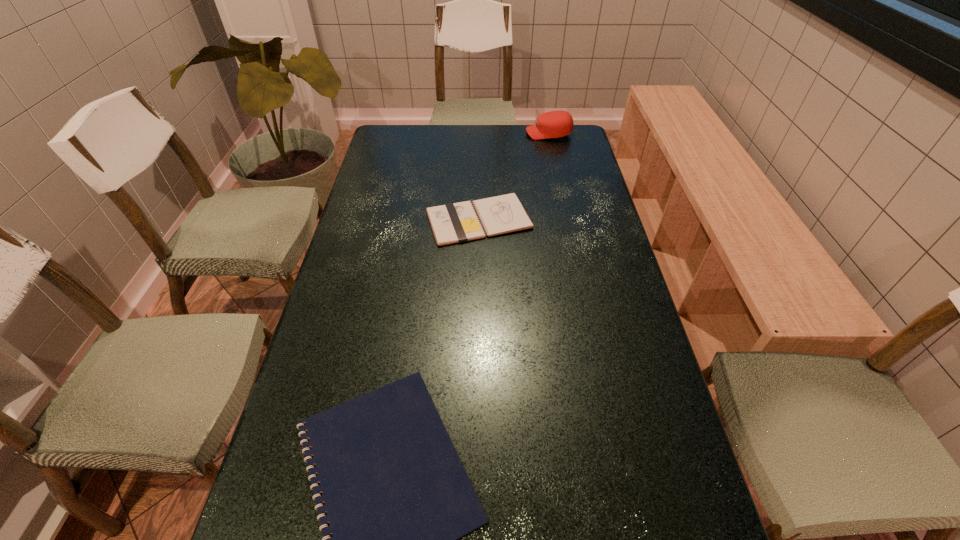
This screenshot has height=540, width=960. I want to click on object present at the far right corner, so click(553, 124).

You are a GUI agent. You are given a task and a screenshot of the screen. Output one action in this format:
    pyautogui.click(x=<x>, y=<y>)
    Task: Click on the blank space at the far edge
    
    Given the screenshot: What is the action you would take?
    pyautogui.click(x=489, y=135)

In the image, there is a desktop. Where is `vacant space at the left edge`? vacant space at the left edge is located at coordinates (387, 221).

This screenshot has height=540, width=960. In the image, there is a desktop. Find the location of `vacant space at the right edge`. vacant space at the right edge is located at coordinates (624, 434).

In the image, there is a desktop. Where is `vacant space at the far left corner`? This screenshot has height=540, width=960. vacant space at the far left corner is located at coordinates (408, 125).

Locate an element on the screen. Image resolution: width=960 pixels, height=540 pixels. vacant space at the far right corner is located at coordinates pyautogui.click(x=559, y=140).

This screenshot has height=540, width=960. Identify the location of free space between the tallest object and the farther notepad. (514, 177).

Where is `object that is the closest to the second shortest object`? The height and width of the screenshot is (540, 960). object that is the closest to the second shortest object is located at coordinates (553, 124).

At what (x,y) coordinates should I click in order to perform the action: click on the second closest object to the nearest object. Please return your answer as a coordinate pair (x, y). The width and height of the screenshot is (960, 540). Looking at the image, I should click on (553, 124).

At what (x,y) coordinates should I click in order to perform the action: click on free spot that satisfies the following two spatial constraints: 1. on the front-facing side of the cap; 2. on the front side of the second nearest object. Please return your answer as a coordinate pair (x, y). The image size is (960, 540). Looking at the image, I should click on (567, 220).